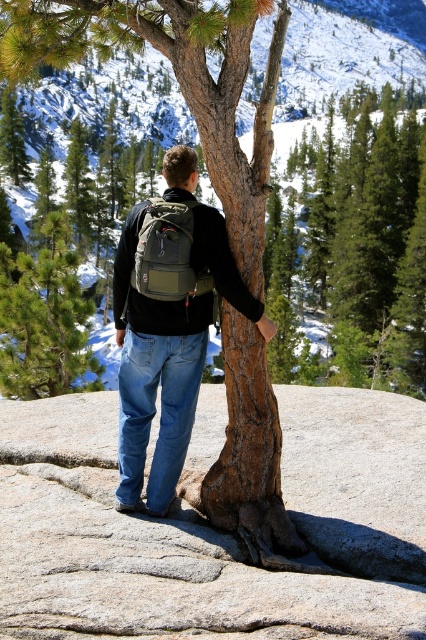
You are a hiker who wants to take a photo of the olive green fabric backpack at center without the green textured pine tree at center blocking the view. Where should you move relative to the current position?

The green textured pine tree at center is positioned over the olive green fabric backpack at center, so you should move to the side or behind the backpack to avoid the tree blocking the view.

You are a photographer wanting to capture the person in the image while ensuring the rough textured rock at center and the denim jeans at center are both in focus. Given that your camera has a depth of field that can cover 10 feet, will you need to adjust your settings to include both objects?

The distance between the rough textured rock at center and denim jeans at center is 11.19 feet. Since the depth of field can only cover 10 feet, you will need to adjust your camera settings to ensure both objects are in focus.

You are planning to take a photo of the rough textured rock at center and the green textured pine tree at center. Which object is closer to the camera?

The rough textured rock at center is positioned under the green textured pine tree at center, so the rock is closer to the camera than the pine tree.